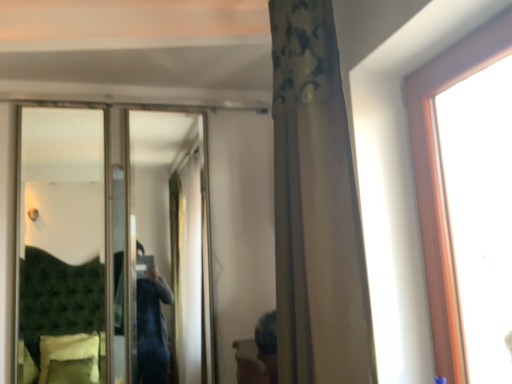
What is the approximate height of white textured curtain at center?

white textured curtain at center is 4.32 feet tall.

This screenshot has width=512, height=384. What do you see at coordinates (316, 206) in the screenshot? I see `white textured curtain at center` at bounding box center [316, 206].

The width and height of the screenshot is (512, 384). Find the location of `white textured curtain at center`. white textured curtain at center is located at coordinates (316, 206).

The image size is (512, 384). What do you see at coordinates (68, 247) in the screenshot? I see `metallic silver mirror at center` at bounding box center [68, 247].

What is the approximate width of metallic silver mirror at center?

The width of metallic silver mirror at center is 2.23 inches.

Identify the location of metallic silver mirror at center. This screenshot has height=384, width=512. (68, 247).

The height and width of the screenshot is (384, 512). Identify the location of white textured curtain at center. (316, 206).

In the image, is metallic silver mirror at center on the left side or the right side of white textured curtain at center?

In the image, metallic silver mirror at center appears on the left side of white textured curtain at center.

Is the position of metallic silver mirror at center more distant than that of white textured curtain at center?

Yes, metallic silver mirror at center is further from the camera.

Is point (158, 118) farther from viewer compared to point (328, 119)?

Yes, it is behind point (328, 119).

From the image's perspective, between metallic silver mirror at center and white textured curtain at center, which one is located above?

white textured curtain at center.

From a real-world perspective, between metallic silver mirror at center and white textured curtain at center, who is vertically higher?

white textured curtain at center, from a real-world perspective.

Considering the relative sizes of metallic silver mirror at center and white textured curtain at center in the image provided, is metallic silver mirror at center wider than white textured curtain at center?

Incorrect, the width of metallic silver mirror at center does not surpass that of white textured curtain at center.

Considering the sizes of objects metallic silver mirror at center and white textured curtain at center in the image provided, who is shorter, metallic silver mirror at center or white textured curtain at center?

metallic silver mirror at center is shorter.

Based on the photo, which of these two, metallic silver mirror at center or white textured curtain at center, is bigger?

With larger size is white textured curtain at center.

Is metallic silver mirror at center surrounding white textured curtain at center?

No, metallic silver mirror at center does not contain white textured curtain at center.

Is metallic silver mirror at center far from white textured curtain at center?

No, metallic silver mirror at center is not far away from white textured curtain at center.

Is metallic silver mirror at center facing away from white textured curtain at center?

No, metallic silver mirror at center is not facing away from white textured curtain at center.

Looking at this image, how different are the orientations of metallic silver mirror at center and white textured curtain at center in degrees?

metallic silver mirror at center and white textured curtain at center are facing 91.4 degrees away from each other.

Measure the distance between metallic silver mirror at center and white textured curtain at center.

metallic silver mirror at center is 37.22 inches from white textured curtain at center.

The width and height of the screenshot is (512, 384). What are the coordinates of `curtain that is on the right side of metallic silver mirror at center` in the screenshot? It's located at (316, 206).

Looking at this image, considering the positions of objects white textured curtain at center and metallic silver mirror at center in the image provided, who is more to the left, white textured curtain at center or metallic silver mirror at center?

metallic silver mirror at center is more to the left.

Based on the photo, is white textured curtain at center in front of or behind metallic silver mirror at center in the image?

white textured curtain at center is in front of metallic silver mirror at center.

Is point (300, 346) positioned in front of point (66, 333)?

That is True.

From the image's perspective, is white textured curtain at center located above or below metallic silver mirror at center?

From the image's perspective, white textured curtain at center appears above metallic silver mirror at center.

From a real-world perspective, is white textured curtain at center physically below metallic silver mirror at center?

Actually, white textured curtain at center is physically above metallic silver mirror at center in the real world.

In terms of width, does white textured curtain at center look wider or thinner when compared to metallic silver mirror at center?

Considering their sizes, white textured curtain at center looks broader than metallic silver mirror at center.

Does white textured curtain at center have a greater height compared to metallic silver mirror at center?

Correct, white textured curtain at center is much taller as metallic silver mirror at center.

Can you confirm if white textured curtain at center is smaller than metallic silver mirror at center?

No, white textured curtain at center is not smaller than metallic silver mirror at center.

Based on the photo, is metallic silver mirror at center a part of white textured curtain at center?

No, metallic silver mirror at center is located outside of white textured curtain at center.

Does white textured curtain at center touch metallic silver mirror at center?

white textured curtain at center and metallic silver mirror at center are not in contact.

Is white textured curtain at center aimed at metallic silver mirror at center?

No, white textured curtain at center is not oriented towards metallic silver mirror at center.

Locate an element on the screen. Image resolution: width=512 pixels, height=384 pixels. curtain on the right of the metallic silver mirror at center is located at coordinates (316, 206).

The height and width of the screenshot is (384, 512). In order to click on curtain that is above the metallic silver mirror at center (from the image's perspective) in this screenshot , I will do `click(316, 206)`.

The image size is (512, 384). What are the coordinates of `curtain lying in front of the metallic silver mirror at center` in the screenshot? It's located at (316, 206).